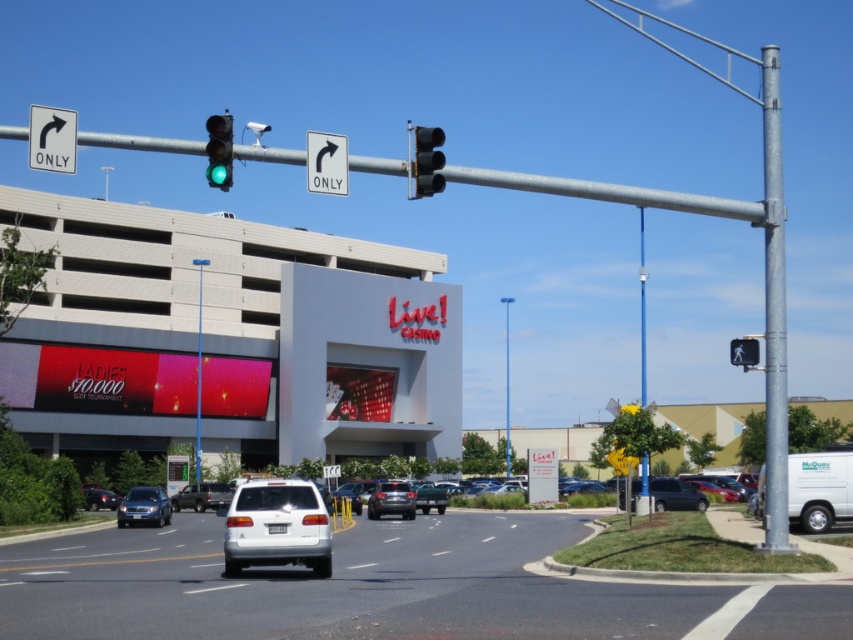
Question: Considering the real-world distances, which object is farthest from the matte black suv at lower left?

Choices:
 (A) matte blue suv at lower left
 (B) dark gray metallic suv at lower right
 (C) silver metallic sedan at center

Answer: (B)

Question: Is white smooth building at center in front of galvanized steel pole at right?

Choices:
 (A) no
 (B) yes

Answer: (A)

Question: Does white smooth building at center have a larger size compared to silver metallic suv at center?

Choices:
 (A) yes
 (B) no

Answer: (A)

Question: Among these points, which one is farthest from the camera?

Choices:
 (A) (44, 134)
 (B) (401, 484)
 (C) (733, 349)
 (D) (640, 262)

Answer: (D)

Question: Among these points, which one is farthest from the camera?

Choices:
 (A) (643, 502)
 (B) (662, 509)
 (C) (79, 134)
 (D) (253, 518)

Answer: (B)

Question: Is galvanized steel pole at right positioned behind green glass traffic light at upper left?

Choices:
 (A) no
 (B) yes

Answer: (B)